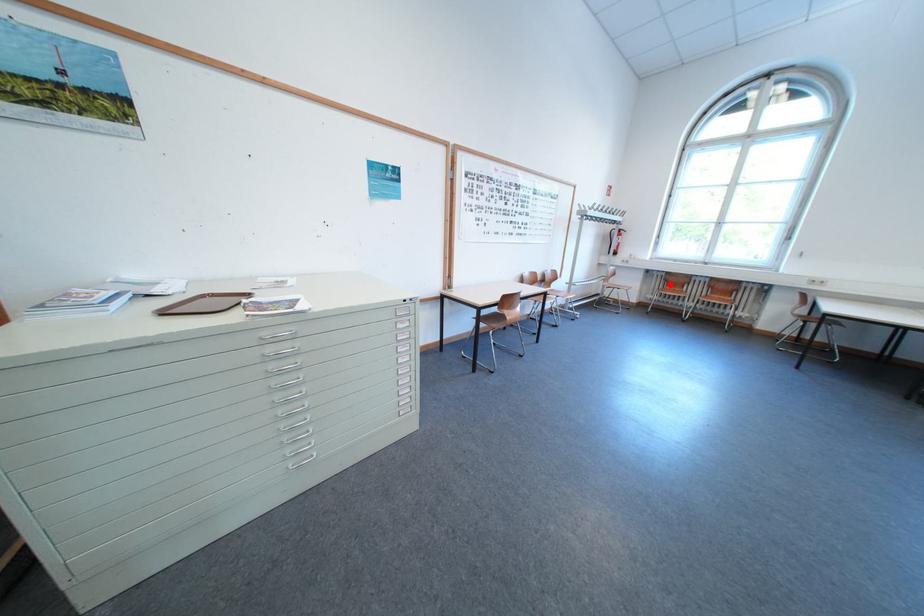
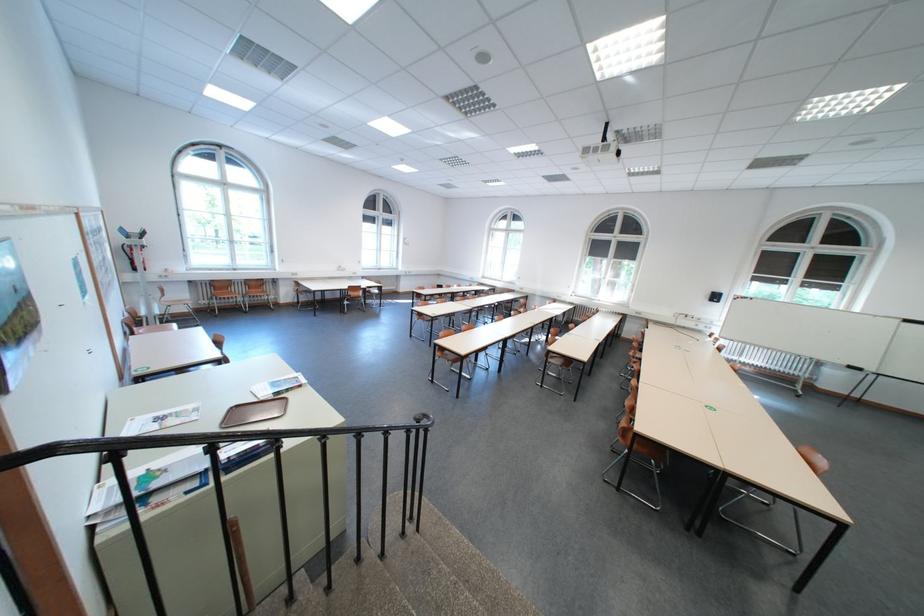
Find the pixel in the second image that matches the highlighted location in the first image.

(219, 292)